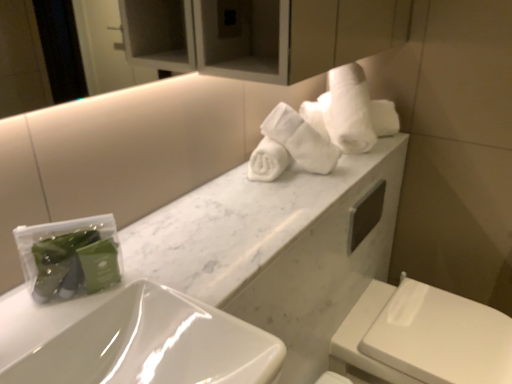
Question: Should I look upward or downward to see white glossy toilet at lower right?

Choices:
 (A) down
 (B) up

Answer: (A)

Question: From a real-world perspective, is white glossy sink at lower left beneath white soft towel at upper right?

Choices:
 (A) no
 (B) yes

Answer: (B)

Question: Is white glossy sink at lower left with white soft towel at upper right?

Choices:
 (A) yes
 (B) no

Answer: (B)

Question: Is white glossy sink at lower left to the left of white soft towel at upper right from the viewer's perspective?

Choices:
 (A) yes
 (B) no

Answer: (A)

Question: From a real-world perspective, does white glossy sink at lower left stand above white soft towel at upper right?

Choices:
 (A) no
 (B) yes

Answer: (A)

Question: Can you confirm if white glossy sink at lower left is taller than white soft towel at upper right?

Choices:
 (A) no
 (B) yes

Answer: (A)

Question: Can you confirm if white glossy sink at lower left is thinner than white soft towel at upper right?

Choices:
 (A) no
 (B) yes

Answer: (A)

Question: Is white glossy toilet at lower right positioned with its back to white marble countertop at center?

Choices:
 (A) no
 (B) yes

Answer: (A)

Question: From a real-world perspective, is white glossy toilet at lower right positioned over white marble countertop at center based on gravity?

Choices:
 (A) no
 (B) yes

Answer: (A)

Question: Could you tell me if white glossy toilet at lower right is turned towards white marble countertop at center?

Choices:
 (A) yes
 (B) no

Answer: (B)

Question: Considering the relative positions of white glossy toilet at lower right and white marble countertop at center in the image provided, is white glossy toilet at lower right to the left of white marble countertop at center from the viewer's perspective?

Choices:
 (A) yes
 (B) no

Answer: (B)

Question: Considering the relative positions of white glossy toilet at lower right and white marble countertop at center in the image provided, is white glossy toilet at lower right behind white marble countertop at center?

Choices:
 (A) yes
 (B) no

Answer: (A)

Question: Considering the relative sizes of white glossy toilet at lower right and white marble countertop at center in the image provided, is white glossy toilet at lower right taller than white marble countertop at center?

Choices:
 (A) no
 (B) yes

Answer: (B)

Question: Does white soft towel at upper right come behind white glossy sink at lower left?

Choices:
 (A) yes
 (B) no

Answer: (A)